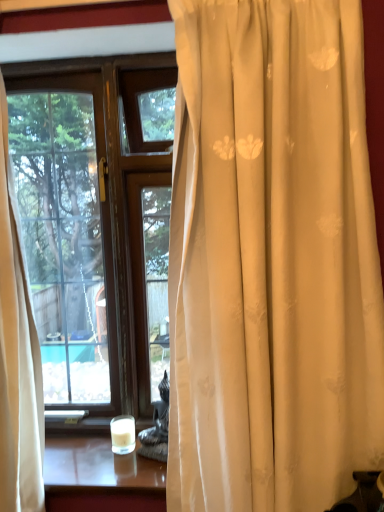
The width and height of the screenshot is (384, 512). Describe the element at coordinates (157, 426) in the screenshot. I see `black textured statue at lower center` at that location.

The width and height of the screenshot is (384, 512). I want to click on black textured statue at lower center, so click(x=157, y=426).

I want to click on white glass candle at lower center, so click(123, 434).

What do you see at coordinates (123, 434) in the screenshot? I see `white glass candle at lower center` at bounding box center [123, 434].

This screenshot has height=512, width=384. What are the coordinates of `black textured statue at lower center` in the screenshot? It's located at (157, 426).

Between black textured statue at lower center and white glass candle at lower center, which one appears on the right side from the viewer's perspective?

black textured statue at lower center.

Is the depth of black textured statue at lower center less than that of white glass candle at lower center?

Yes, black textured statue at lower center is closer to the camera.

Is point (161, 393) closer or farther from the camera than point (116, 426)?

Point (161, 393) is farther from the camera than point (116, 426).

From the image's perspective, is black textured statue at lower center located above or below white glass candle at lower center?

black textured statue at lower center is above white glass candle at lower center.

From a real-world perspective, is black textured statue at lower center under white glass candle at lower center?

No, from a real-world perspective, black textured statue at lower center is not under white glass candle at lower center.

Between black textured statue at lower center and white glass candle at lower center, which one has smaller width?

white glass candle at lower center is thinner.

Consider the image. Between black textured statue at lower center and white glass candle at lower center, which one has less height?

With less height is white glass candle at lower center.

Looking at the image, does black textured statue at lower center seem bigger or smaller compared to white glass candle at lower center?

In the image, black textured statue at lower center appears to be larger than white glass candle at lower center.

Is black textured statue at lower center situated inside white glass candle at lower center or outside?

black textured statue at lower center cannot be found inside white glass candle at lower center.

Is black textured statue at lower center next to white glass candle at lower center?

Yes, black textured statue at lower center is with white glass candle at lower center.

Is black textured statue at lower center positioned with its back to white glass candle at lower center?

That's not correct — black textured statue at lower center is not looking away from white glass candle at lower center.

How different are the orientations of black textured statue at lower center and white glass candle at lower center in degrees?

20.7 degrees.

How much distance is there between black textured statue at lower center and white glass candle at lower center?

black textured statue at lower center and white glass candle at lower center are 3.19 inches apart from each other.

Identify the location of candle holder on the left of the black textured statue at lower center. (123, 434).

Which object is positioned more to the left, white glass candle at lower center or black textured statue at lower center?

Positioned to the left is white glass candle at lower center.

Is white glass candle at lower center further to the viewer compared to black textured statue at lower center?

That is True.

Is point (121, 426) closer to camera compared to point (145, 445)?

No, it is behind (145, 445).

From the image's perspective, is white glass candle at lower center under black textured statue at lower center?

Correct, white glass candle at lower center appears lower than black textured statue at lower center in the image.

From a real-world perspective, is white glass candle at lower center above or below black textured statue at lower center?

From a real-world perspective, white glass candle at lower center is physically below black textured statue at lower center.

Is white glass candle at lower center wider or thinner than black textured statue at lower center?

Clearly, white glass candle at lower center has less width compared to black textured statue at lower center.

From the picture: Is white glass candle at lower center shorter than black textured statue at lower center?

Indeed, white glass candle at lower center has a lesser height compared to black textured statue at lower center.

Considering the sizes of objects white glass candle at lower center and black textured statue at lower center in the image provided, who is bigger, white glass candle at lower center or black textured statue at lower center?

Bigger between the two is black textured statue at lower center.

Is white glass candle at lower center inside or outside of black textured statue at lower center?

white glass candle at lower center is outside black textured statue at lower center.

Would you say white glass candle at lower center is a long distance from black textured statue at lower center?

No, there isn't a large distance between white glass candle at lower center and black textured statue at lower center.

Is white glass candle at lower center positioned with its back to black textured statue at lower center?

No, black textured statue at lower center is not at the back of white glass candle at lower center.

Can you tell me how much white glass candle at lower center and black textured statue at lower center differ in facing direction?

The facing directions of white glass candle at lower center and black textured statue at lower center are 20.7 degrees apart.

This screenshot has height=512, width=384. I want to click on chair on the right of white glass candle at lower center, so click(x=157, y=426).

Locate an element on the screen. The width and height of the screenshot is (384, 512). chair that is above the white glass candle at lower center (from a real-world perspective) is located at coordinates (157, 426).

The width and height of the screenshot is (384, 512). In order to click on chair that is above the white glass candle at lower center (from the image's perspective) in this screenshot , I will do `click(157, 426)`.